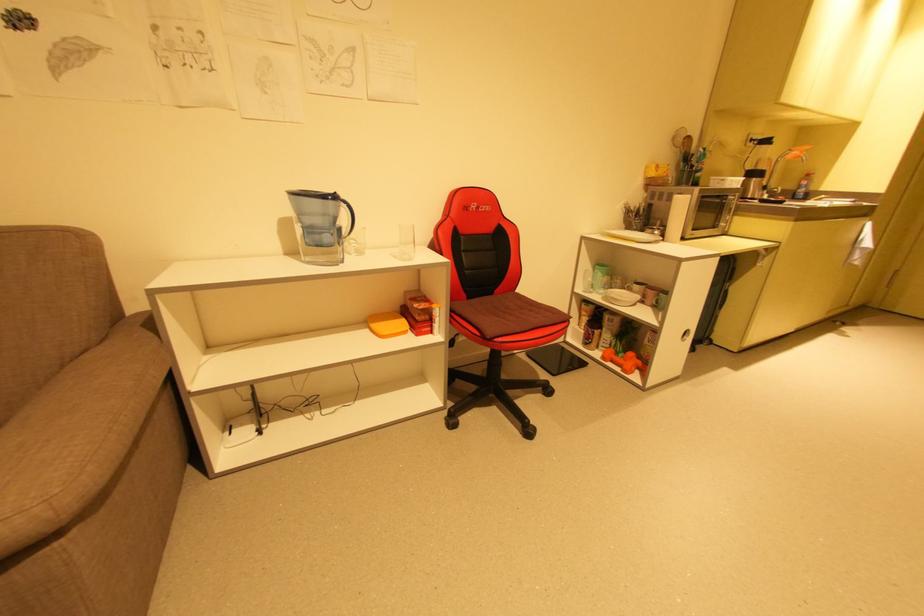
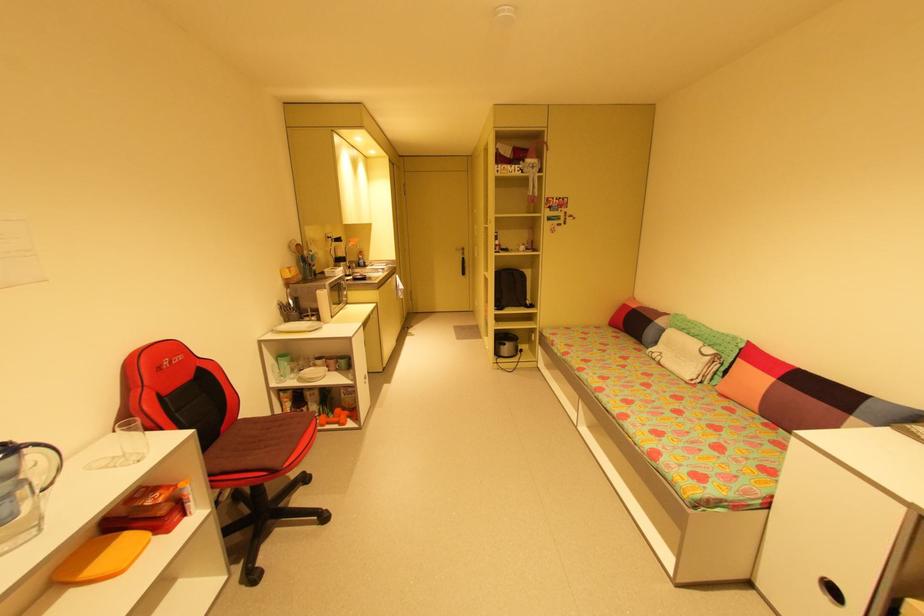
Find the pixel in the second image that matches (x=346, y=204) in the first image.

(30, 450)